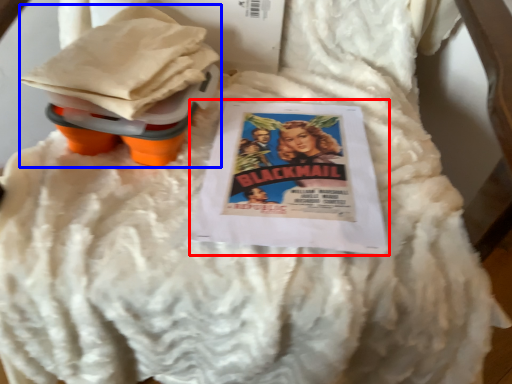
Question: Which object is closer to the camera taking this photo, comic book (highlighted by a red box) or toy (highlighted by a blue box)?

Choices:
 (A) comic book
 (B) toy

Answer: (B)